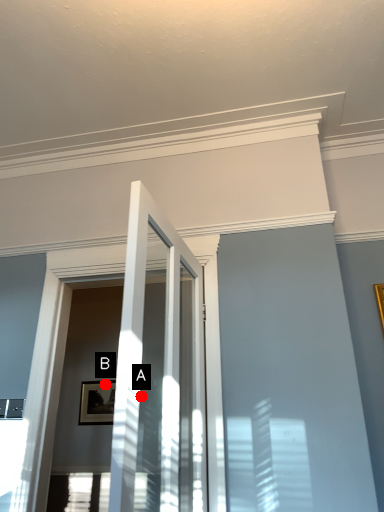
Question: Two points are circled on the image, labeled by A and B beside each circle. Which point appears closest to the camera in this image?

Choices:
 (A) A is closer
 (B) B is closer

Answer: (A)